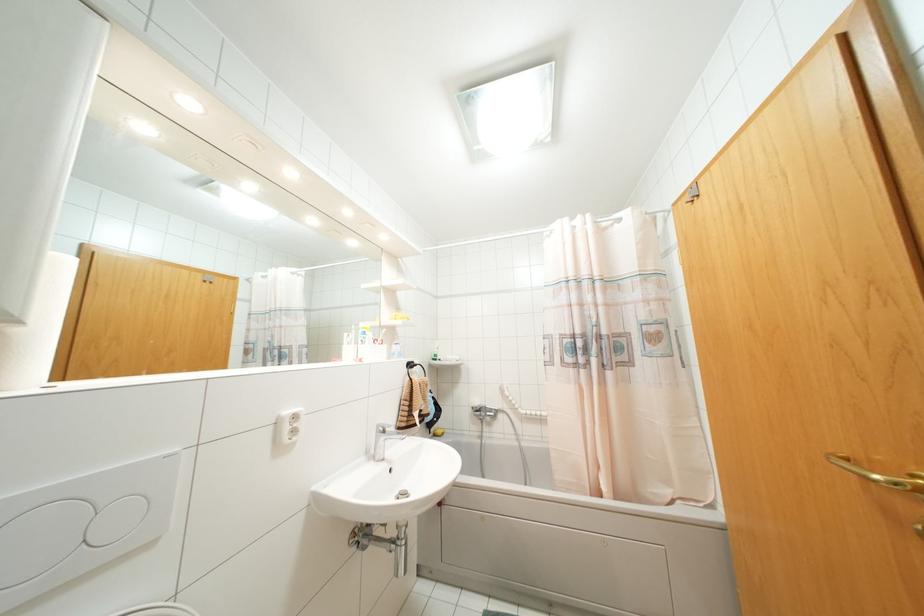
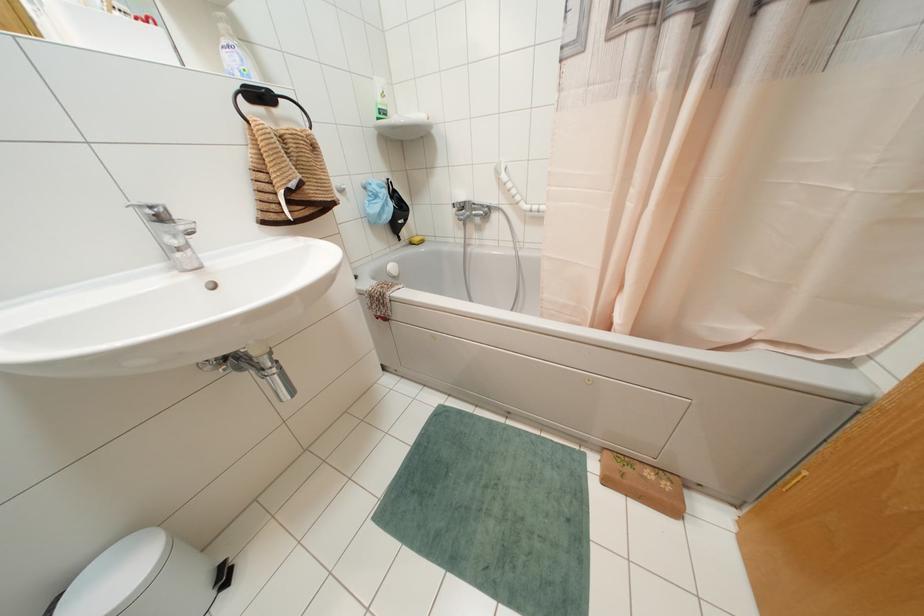
Question: The first image is from the beginning of the video and the second image is from the end. How did the camera likely rotate when shooting the video?

Choices:
 (A) Left
 (B) Right
 (C) Up
 (D) Down

Answer: (D)